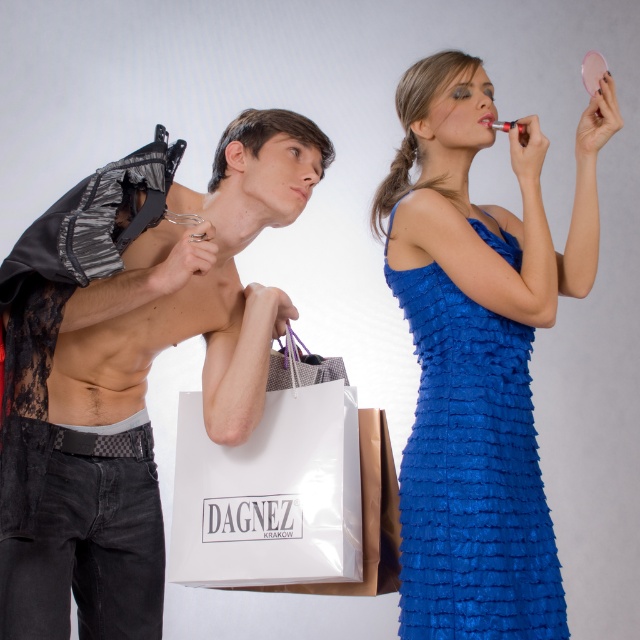
Question: Which point is closer to the camera?

Choices:
 (A) (0, 486)
 (B) (472, 516)

Answer: (A)

Question: Where is blue ruffled fabric dress at upper right located in relation to white paper shopping bag at center in the image?

Choices:
 (A) below
 (B) above

Answer: (B)

Question: Which point appears closest to the camera in this image?

Choices:
 (A) (305, 416)
 (B) (429, 566)
 (C) (56, 536)

Answer: (B)

Question: Considering the relative positions of lace fabric lingerie at left and blue ruffled fabric dress at upper right in the image provided, where is lace fabric lingerie at left located with respect to blue ruffled fabric dress at upper right?

Choices:
 (A) right
 (B) left

Answer: (B)

Question: Can you confirm if lace fabric lingerie at left is smaller than white paper shopping bag at center?

Choices:
 (A) yes
 (B) no

Answer: (B)

Question: Which point is closer to the camera?

Choices:
 (A) lace fabric lingerie at left
 (B) blue ruffled fabric dress at upper right

Answer: (A)